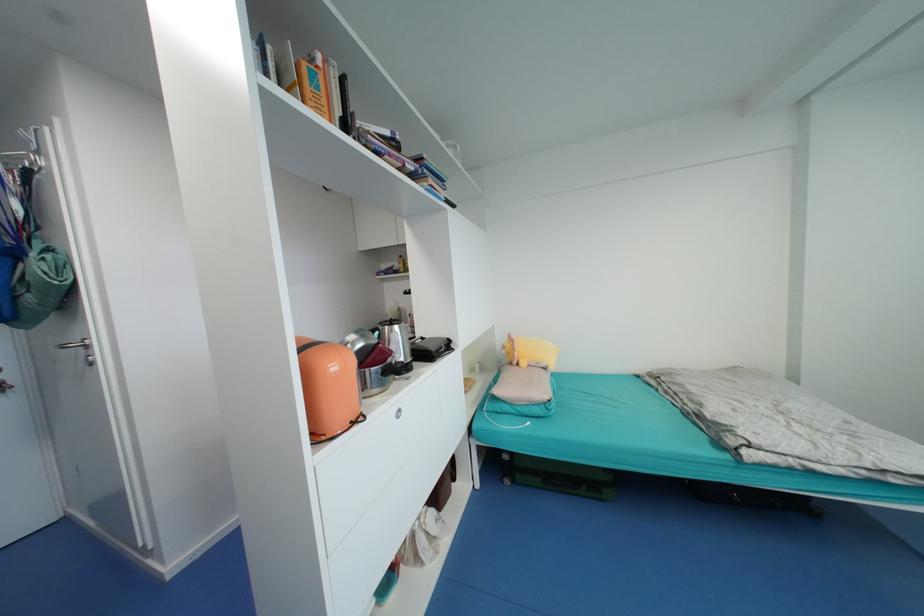
Find where to lift the orange cover book. Please return your answer as a coordinate pair (x, y).

(312, 87)